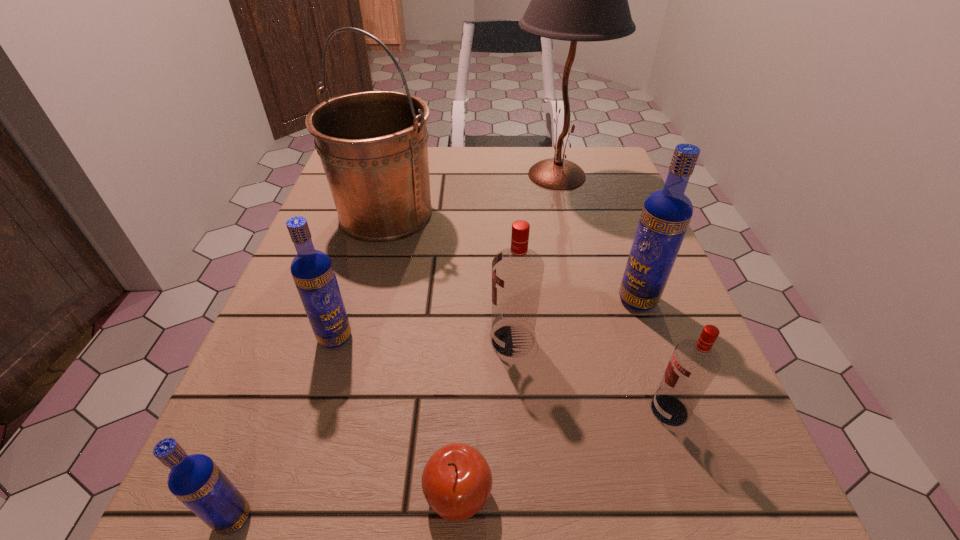
Where is `vacant space located on the front label of the left red vodka`? The width and height of the screenshot is (960, 540). vacant space located on the front label of the left red vodka is located at coordinates (293, 341).

You are a GUI agent. You are given a task and a screenshot of the screen. Output one action in this format:
    pyautogui.click(x=<x>, y=<y>)
    Task: Click on the vacant space positioned on the front label of the left red vodka
    The height and width of the screenshot is (540, 960).
    Given the screenshot: What is the action you would take?
    [376, 341]

The image size is (960, 540). In order to click on vacant region located 0.160m on the front label of the left red vodka in this screenshot , I will do `click(395, 341)`.

The image size is (960, 540). In order to click on free location located 0.100m on the front label of the sixth farthest object in this screenshot , I will do `click(582, 410)`.

Where is `vacant space located 0.380m on the front label of the sixth farthest object`? The width and height of the screenshot is (960, 540). vacant space located 0.380m on the front label of the sixth farthest object is located at coordinates (391, 410).

You are a GUI agent. You are given a task and a screenshot of the screen. Output one action in this format:
    pyautogui.click(x=<x>, y=<y>)
    Task: Click on the free region located on the front label of the sixth farthest object
    
    Given the screenshot: What is the action you would take?
    pyautogui.click(x=418, y=410)

Where is `free point located 0.170m on the right of the leftmost blue vodka`? This screenshot has width=960, height=540. free point located 0.170m on the right of the leftmost blue vodka is located at coordinates (391, 518).

Identify the location of free space located 0.050m on the left of the fourth object from left to right. (385, 494).

What are the coordinates of `table lamp present at the far edge` in the screenshot? It's located at (585, 0).

Where is `bucket present at the far edge`? The width and height of the screenshot is (960, 540). bucket present at the far edge is located at coordinates (373, 146).